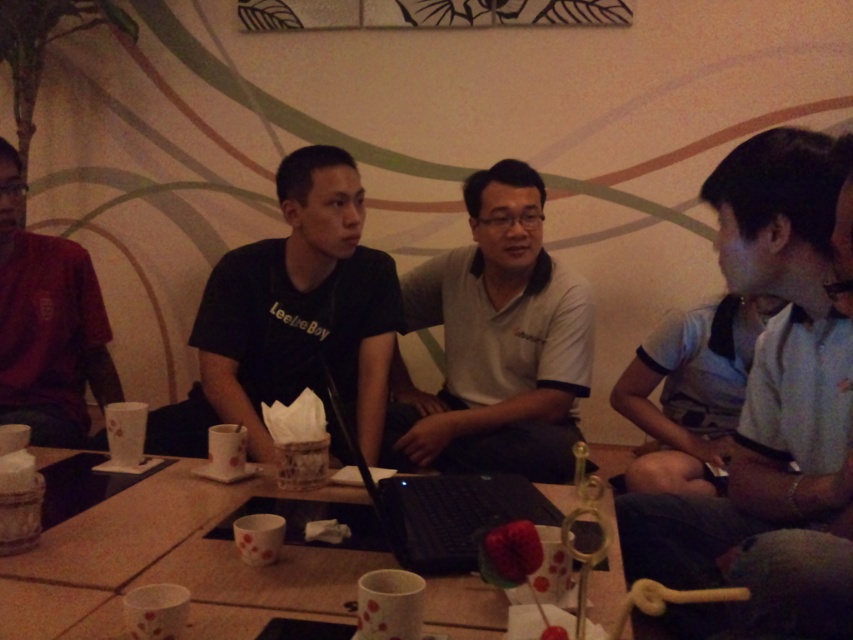
You are a photographer trying to capture a candid shot of the white cotton shirt at right and the white matte shirt at center. Since both are white, you want to ensure you can distinguish them in the photo. Based on their positions, which shirt will appear closer to the bottom of the photo?

The white cotton shirt at right will appear closer to the bottom of the photo because it is positioned under the white matte shirt at center.

You are sitting at the rectangular table and want to hand a note to the person wearing the black matte shirt at center without moving from your seat. Which direction should you pass the note relative to the white matte shirt at center?

Since the black matte shirt at center is behind the white matte shirt at center, you should pass the note behind the white matte shirt at center to reach the person wearing the black matte shirt at center.